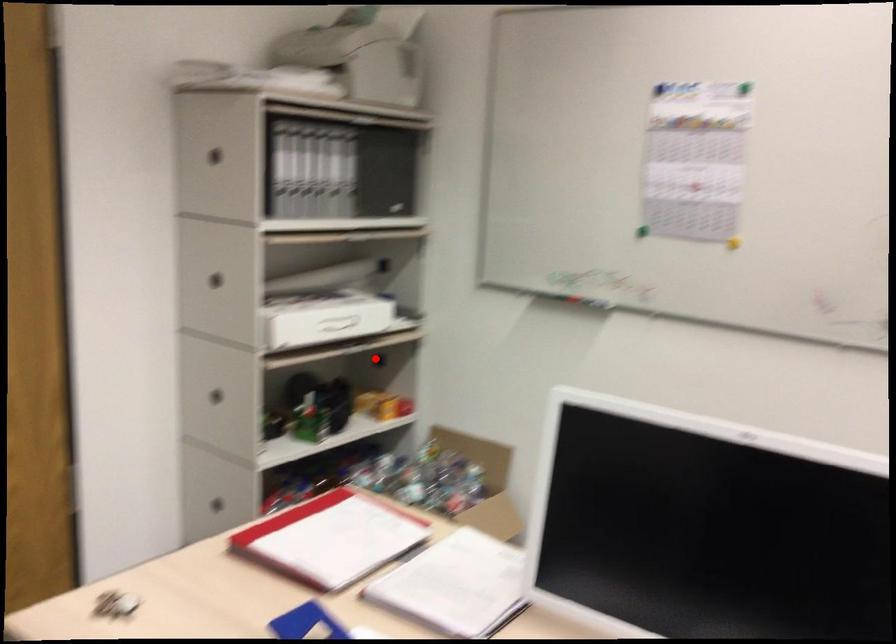
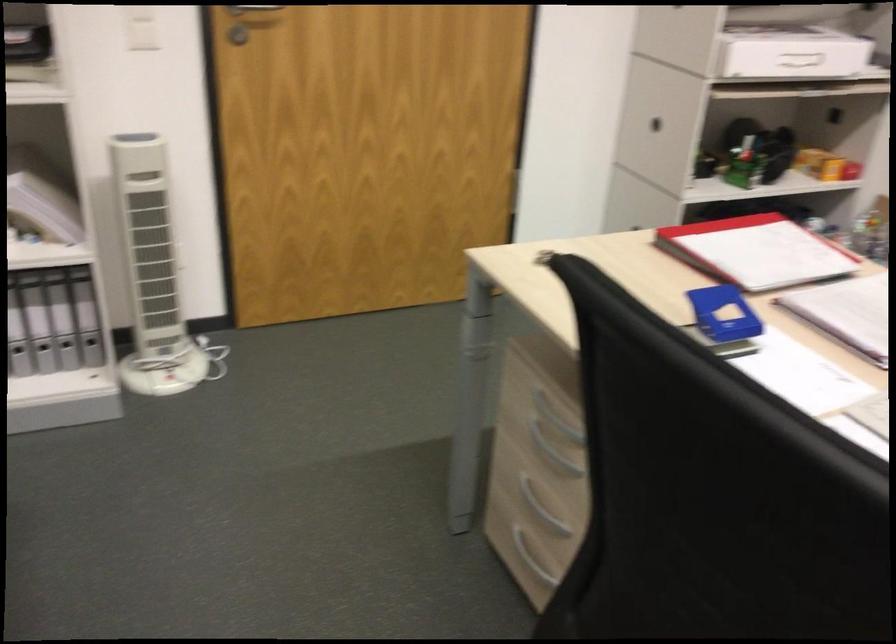
Find the pixel in the second image that matches the highlighted location in the first image.

(833, 116)